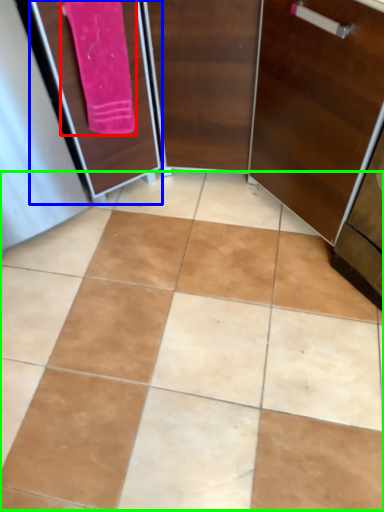
Question: Which object is the closest to the bath towel (highlighted by a red box)? Choose among these: screen door (highlighted by a blue box) or ceramic tile (highlighted by a green box).

Choices:
 (A) screen door
 (B) ceramic tile

Answer: (A)